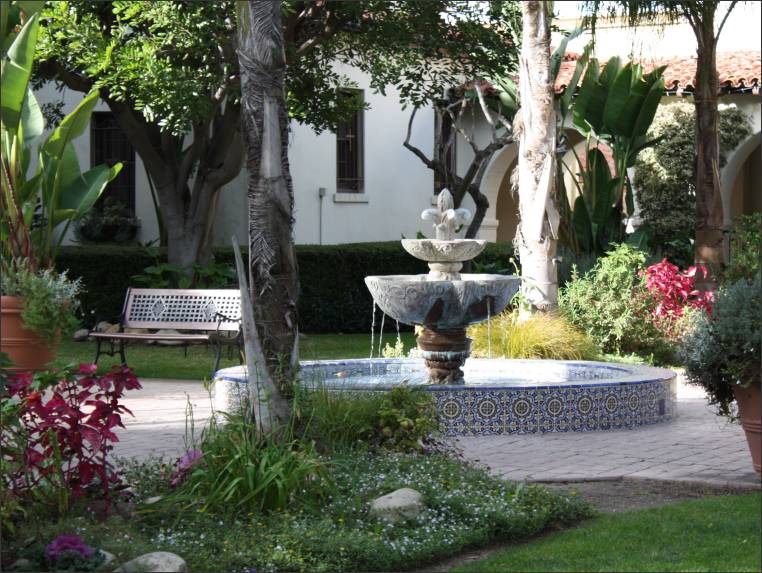
The image size is (762, 573). What are the coordinates of `tile` in the screenshot? It's located at [x=476, y=422].